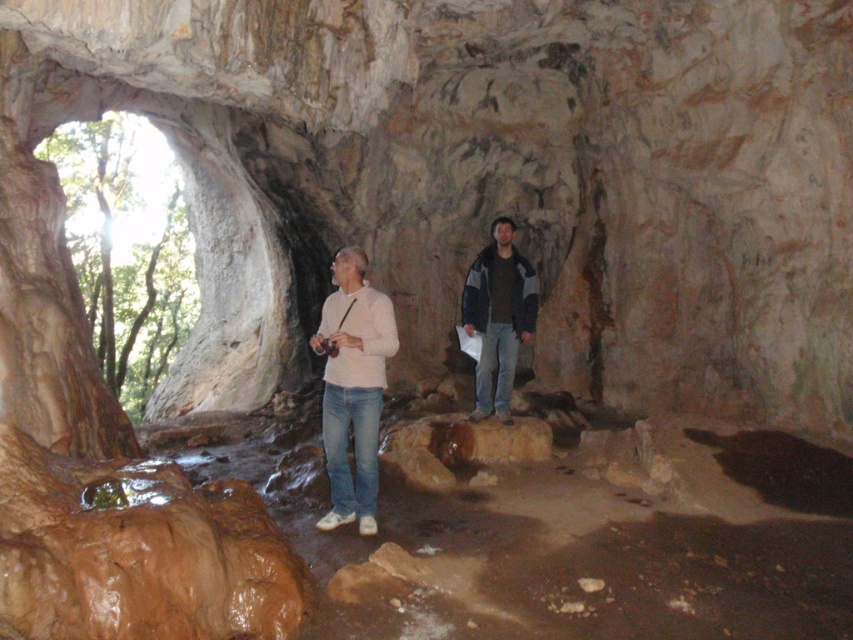
Question: Observing the image, what is the correct spatial positioning of light beige jeans at center in reference to brown rough rock at center?

Choices:
 (A) right
 (B) left

Answer: (B)

Question: Estimate the real-world distances between objects in this image. Which object is farther from the brown rough rock at center?

Choices:
 (A) light beige jeans at center
 (B) dark gray fleece jacket at center

Answer: (A)

Question: Among these points, which one is farthest from the camera?

Choices:
 (A) (515, 356)
 (B) (357, 465)
 (C) (378, 349)

Answer: (A)

Question: Which point is closer to the camera?

Choices:
 (A) (352, 266)
 (B) (354, 420)
 (C) (480, 259)
 (D) (444, 422)

Answer: (A)

Question: Can you confirm if light beige jeans at center is smaller than brown rough rock at center?

Choices:
 (A) no
 (B) yes

Answer: (A)

Question: Is white matte shirt at center to the left of dark gray fleece jacket at center from the viewer's perspective?

Choices:
 (A) yes
 (B) no

Answer: (A)